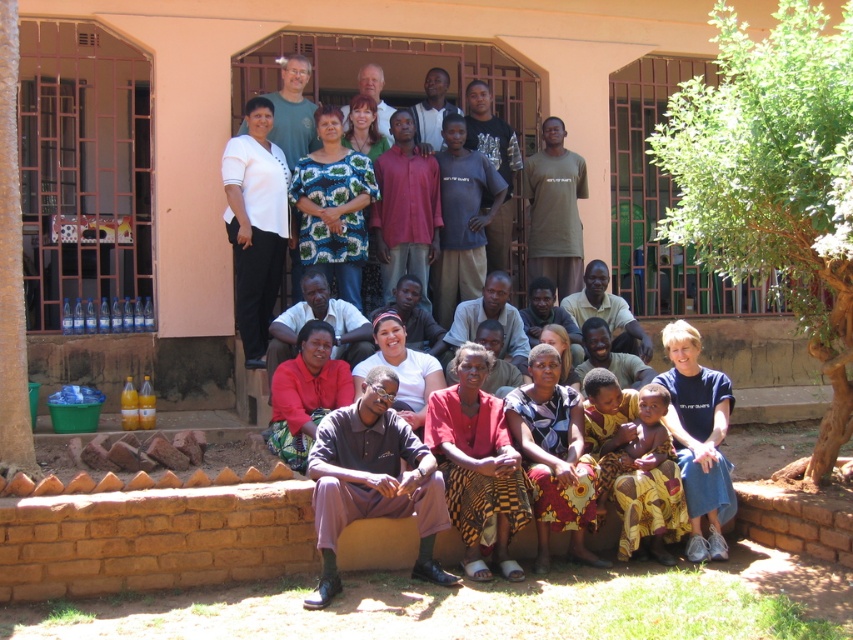
You are organizing a fashion show and need to determine which outfit takes up more space. Based on the image, which of the two outfits, the matte green dress at center or the dark brown fabric pants at lower center, is larger in size?

The matte green dress at center has a larger size compared to the dark brown fabric pants at lower center, so the matte green dress at center takes up more space.

You are a photographer trying to capture the matte green dress at center and the dark brown fabric pants at lower center in the same frame. Based on their positions, which object is located to the left in the image?

The dark brown fabric pants at lower center are located to the left of the matte green dress at center.